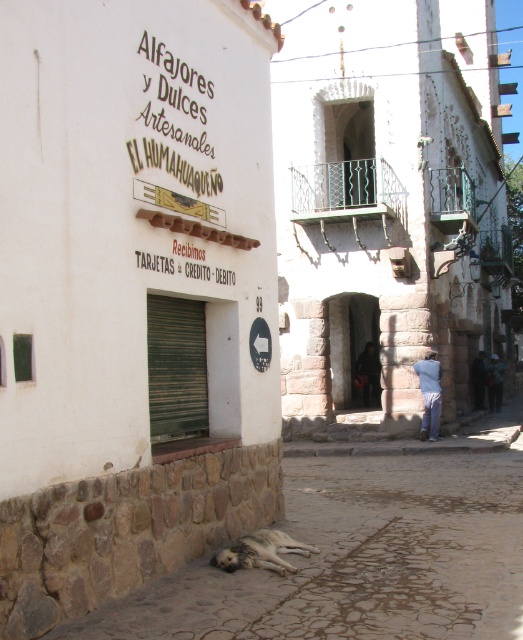
You are a delivery person with a cart that is 1.2 meters wide. You need to navigate through the gray cobblestone pavement at lower center while avoiding the brown fur dog at lower center. Can your cart fit on the pavement without hitting the dog?

The gray cobblestone pavement at lower center is narrower than the brown fur dog at lower center, so the pavement is too narrow for the 1.2 meter wide cart. The cart cannot fit on the pavement without hitting the dog.

You are standing at the entrance of the shop and want to step onto the gray cobblestone pavement at lower center. What are the coordinates of the point where you should step?

The gray cobblestone pavement at lower center is located at coordinates point [358,560].